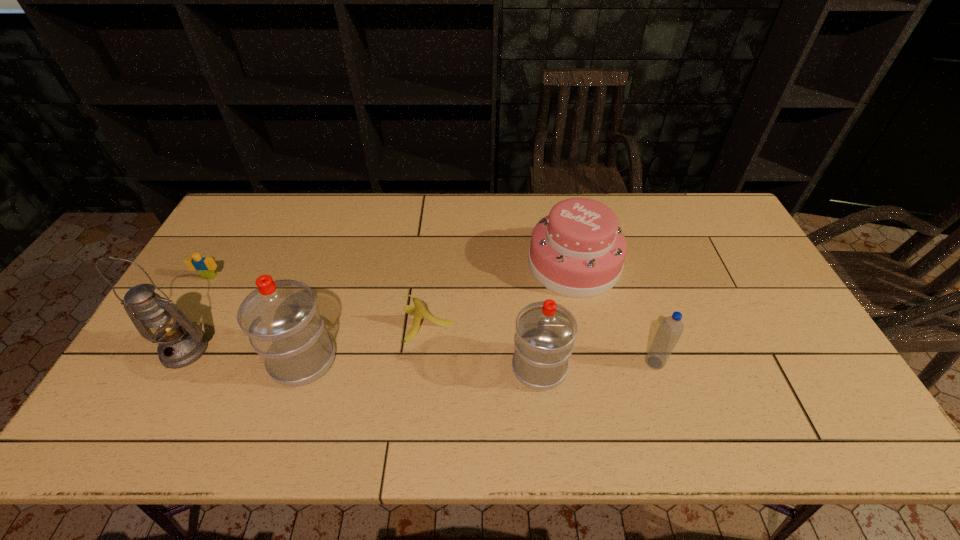
The image size is (960, 540). In order to click on the third object from left to right in this screenshot , I will do `click(281, 318)`.

Locate an element on the screen. the tallest water bottle is located at coordinates (281, 318).

The width and height of the screenshot is (960, 540). I want to click on the second water bottle from left to right, so click(x=545, y=333).

Identify the location of the third tallest object. Image resolution: width=960 pixels, height=540 pixels. (545, 333).

Where is `banana`? The image size is (960, 540). banana is located at coordinates pyautogui.click(x=420, y=311).

The image size is (960, 540). Find the location of `the fourth object from left to right`. the fourth object from left to right is located at coordinates tap(420, 311).

Find the location of a particular element. Lego is located at coordinates click(x=205, y=266).

The width and height of the screenshot is (960, 540). Find the location of `oil lamp`. oil lamp is located at coordinates tap(181, 343).

Locate an element on the screen. cake is located at coordinates click(x=578, y=250).

At what (x,y) coordinates should I click in order to perform the action: click on the shortest water bottle. Please return your answer as a coordinate pair (x, y). The width and height of the screenshot is (960, 540). Looking at the image, I should click on (671, 327).